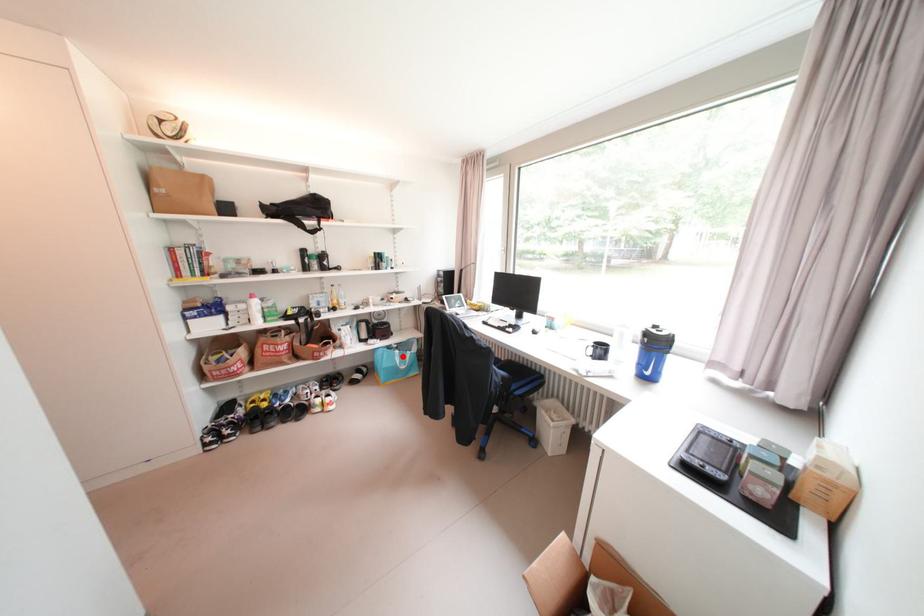
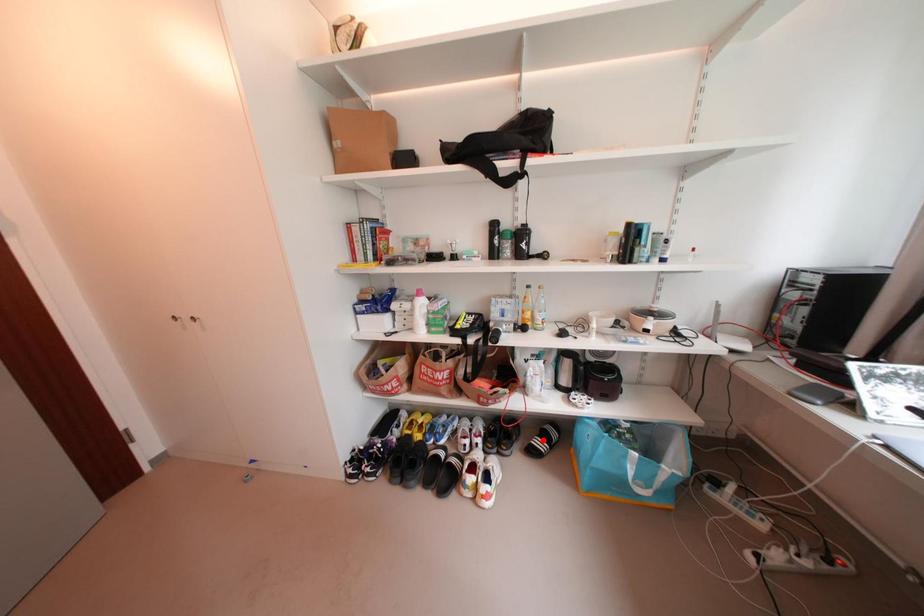
I am providing you with two images of the same scene from different viewpoints. A red point is marked on the first image and another point is marked on the second image. Are the points marked in image1 and image2 representing the same 3D position?

No